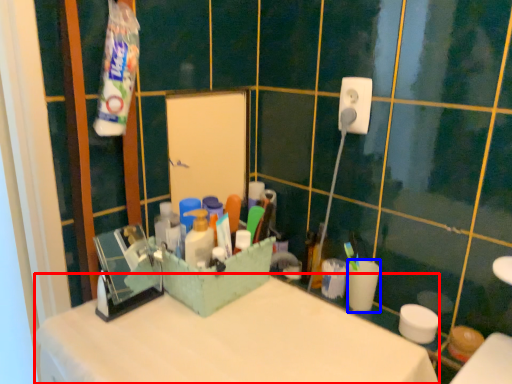
Question: Among these objects, which one is nearest to the camera, counter top (highlighted by a red box) or coffee cup (highlighted by a blue box)?

Choices:
 (A) counter top
 (B) coffee cup

Answer: (A)